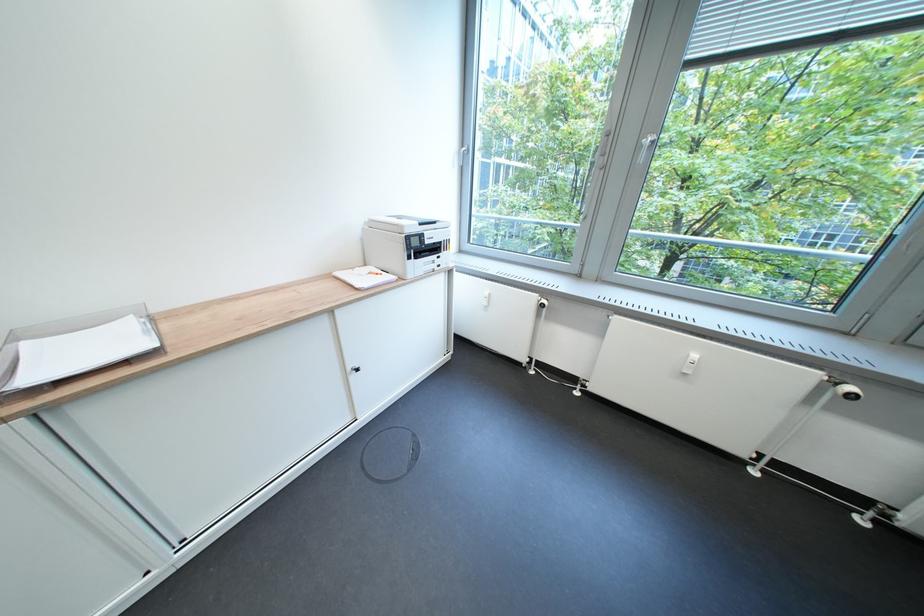
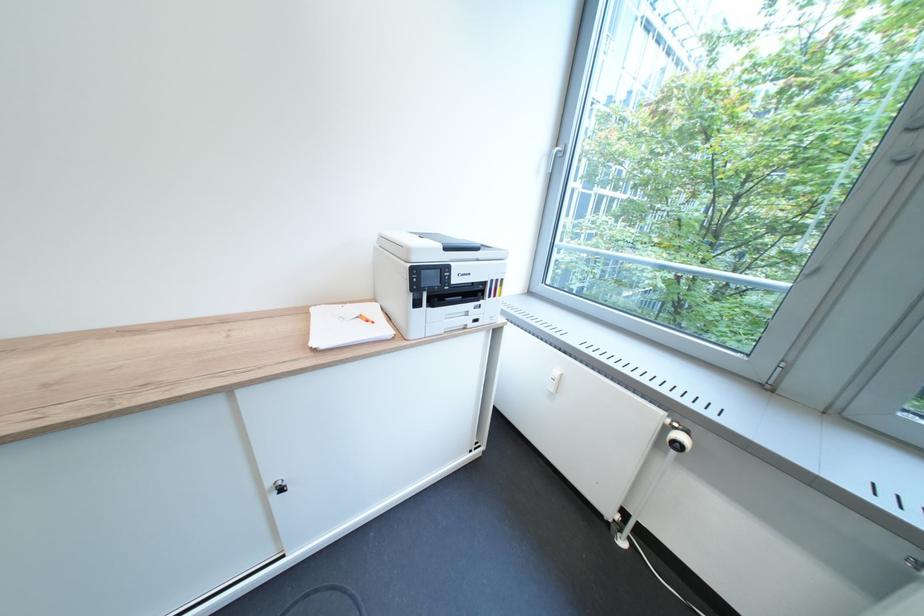
The point at (428, 244) is marked in the first image. Where is the corresponding point in the second image?

(444, 282)